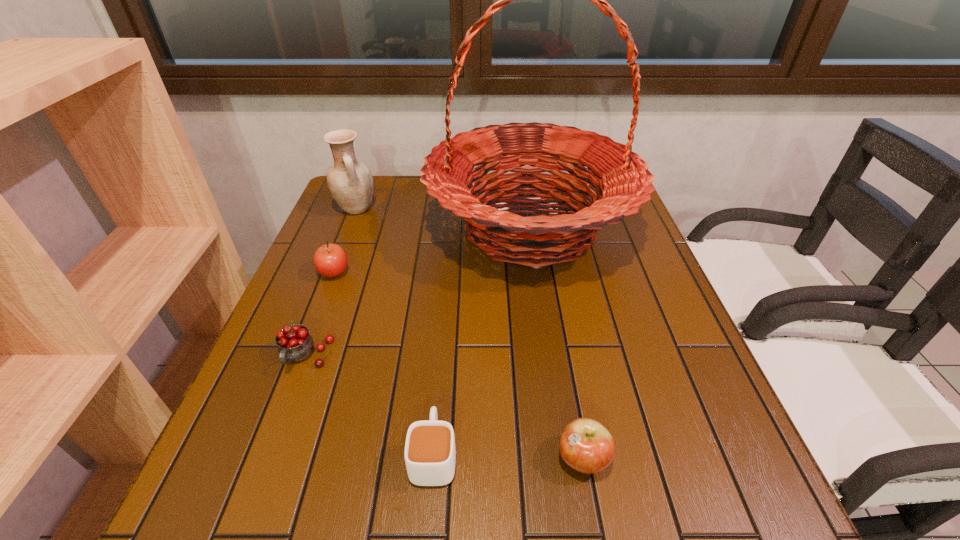
Where is `free space between the taller apple and the cup`? The height and width of the screenshot is (540, 960). free space between the taller apple and the cup is located at coordinates (384, 364).

This screenshot has height=540, width=960. What are the coordinates of `vacant area between the cherry and the farther apple` in the screenshot? It's located at (320, 315).

Where is `empty location between the cup and the shorter apple`? This screenshot has height=540, width=960. empty location between the cup and the shorter apple is located at coordinates (508, 456).

At what (x,y) coordinates should I click in order to perform the action: click on free point between the tallest object and the right apple. Please return your answer as a coordinate pair (x, y). The image size is (960, 540). Looking at the image, I should click on click(x=556, y=343).

Find the location of a particular element. free space between the fourth farthest object and the nearer apple is located at coordinates (444, 407).

Identify the location of vacant space that is in between the left apple and the shorter apple. (458, 366).

Where is `blank region between the basket and the pottery`? This screenshot has width=960, height=540. blank region between the basket and the pottery is located at coordinates [443, 219].

Where is `unoccupied position between the cherry and the nearer apple`? The width and height of the screenshot is (960, 540). unoccupied position between the cherry and the nearer apple is located at coordinates (444, 407).

Identify the location of free area in between the fourth farthest object and the left apple. This screenshot has height=540, width=960. (320, 315).

Locate an element on the screen. This screenshot has width=960, height=540. empty space that is in between the tallest object and the third nearest object is located at coordinates click(x=418, y=293).